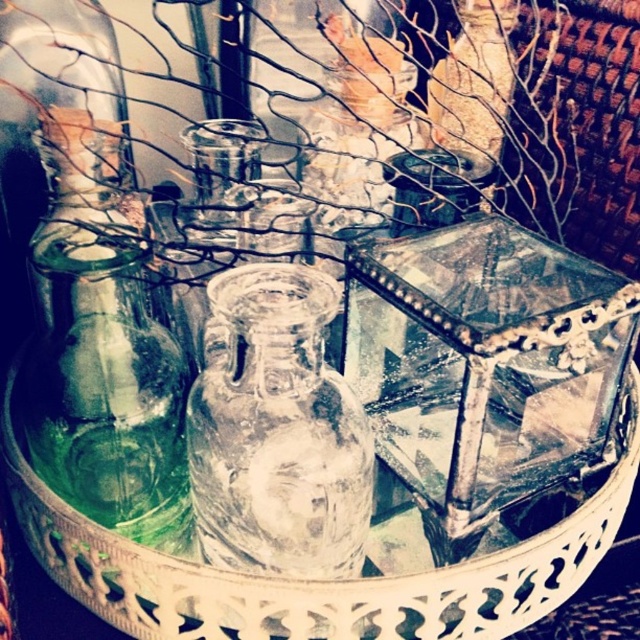
You are arranging flowers for a centerpiece and need to choose between the green glass bottle at left and the transparent glass vase at center. Which one has a larger capacity based on their sizes?

The transparent glass vase at center has a larger capacity than the green glass bottle at left because it is bigger in size.

You are arranging items on a tray and see the green glass bottle at left and the transparent glass vase at center. Which object is positioned more to the left side of the tray?

The green glass bottle at left is positioned more to the left side of the tray than the transparent glass vase at center.

You are arranging a display and need to know which object is taller between the green glass bottle at left and the transparent glass vase at center. According to the scene, which one is taller?

The green glass bottle at left is taller than the transparent glass vase at center.